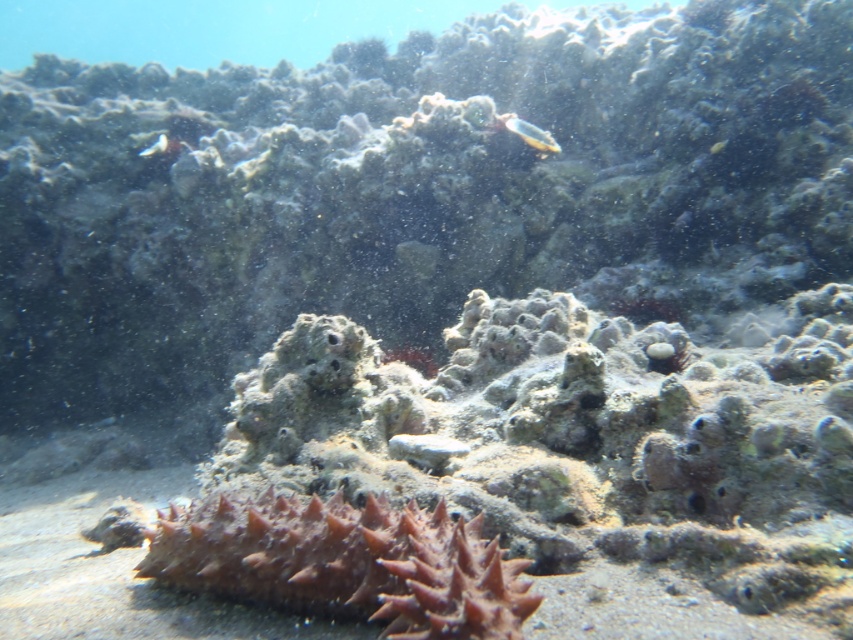
Between translucent plastic fish at upper center and translucent white fish at upper left, which one has less height?

translucent white fish at upper left

How distant is translucent plastic fish at upper center from translucent white fish at upper left?

translucent plastic fish at upper center and translucent white fish at upper left are 1.17 meters apart.

Locate an element on the screen. The width and height of the screenshot is (853, 640). translucent plastic fish at upper center is located at coordinates (531, 134).

Looking at this image, does brown spiky sea cucumber at center appear on the left side of translucent white fish at upper left?

No, brown spiky sea cucumber at center is not to the left of translucent white fish at upper left.

Is brown spiky sea cucumber at center in front of translucent white fish at upper left?

Yes, brown spiky sea cucumber at center is in front of translucent white fish at upper left.

Who is more distant from viewer, (268, 576) or (161, 140)?

The point (161, 140) is more distant.

You are a GUI agent. You are given a task and a screenshot of the screen. Output one action in this format:
    pyautogui.click(x=<x>, y=<y>)
    Task: Click on the brown spiky sea cucumber at center
    
    Given the screenshot: What is the action you would take?
    pyautogui.click(x=346, y=561)

Find the location of a particular element. The image size is (853, 640). brown spiky sea cucumber at center is located at coordinates (346, 561).

Consider the image. Does brown spiky sea cucumber at center have a greater width compared to translucent plastic fish at upper center?

Indeed, brown spiky sea cucumber at center has a greater width compared to translucent plastic fish at upper center.

In order to click on brown spiky sea cucumber at center in this screenshot , I will do `click(346, 561)`.